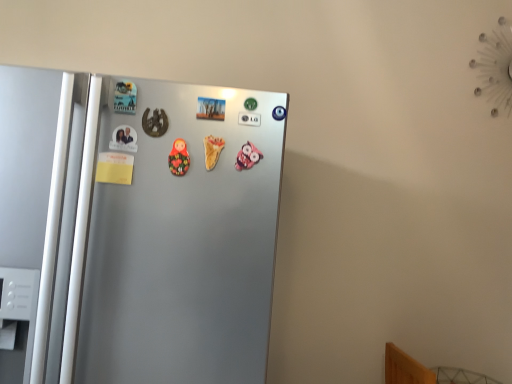
What do you see at coordinates (136, 228) in the screenshot?
I see `satin silver fridge at center` at bounding box center [136, 228].

This screenshot has height=384, width=512. What are the coordinates of `satin silver fridge at center` in the screenshot? It's located at (136, 228).

This screenshot has width=512, height=384. I want to click on satin silver fridge at center, so click(x=136, y=228).